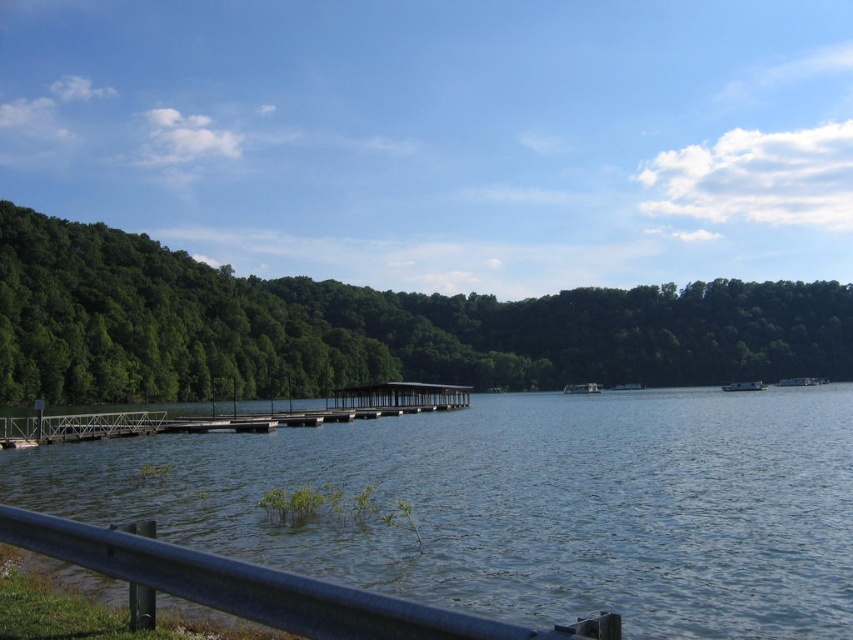
Question: Is green leafy trees at left above metallic silver boat at center-right?

Choices:
 (A) no
 (B) yes

Answer: (B)

Question: Is the position of metallic silver boat at center less distant than that of white plastic boat at center?

Choices:
 (A) no
 (B) yes

Answer: (B)

Question: Is metallic gray dock at center above white plastic boat at center?

Choices:
 (A) no
 (B) yes

Answer: (B)

Question: Which of the following is the farthest from the observer?

Choices:
 (A) metallic gray dock at center
 (B) metallic silver boat at center
 (C) white glossy boat at center
 (D) metallic silver boat at center-right

Answer: (C)

Question: Which point is closer to the camera?

Choices:
 (A) (807, 381)
 (B) (601, 413)
 (C) (120, 428)
 (D) (579, 392)

Answer: (C)

Question: Which object is the farthest from the white plastic boat at center?

Choices:
 (A) metallic silver boat at center-right
 (B) clear water at center
 (C) metallic gray dock at center
 (D) green leafy trees at left

Answer: (B)